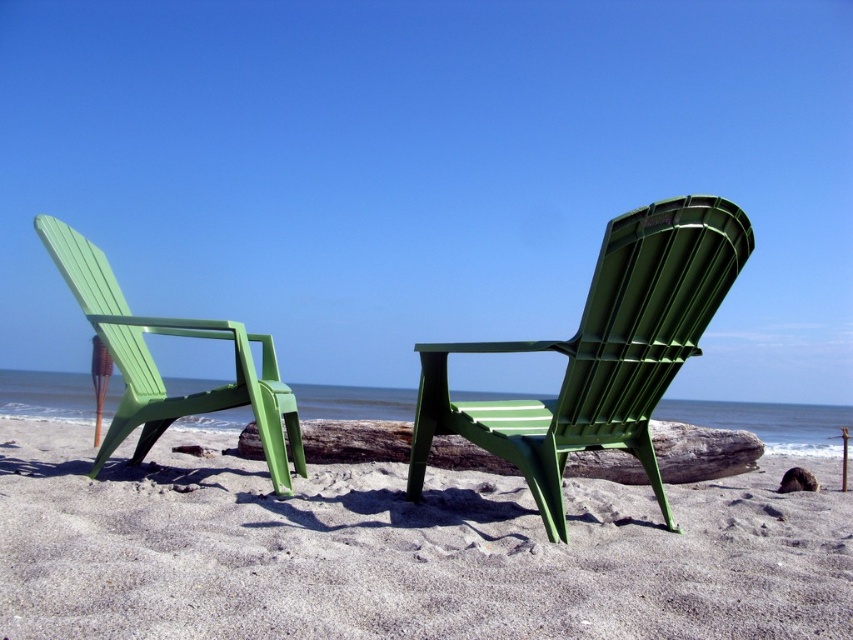
Can you confirm if matte green plastic beach chair at left is positioned below wooden log at center?

No, matte green plastic beach chair at left is not below wooden log at center.

Can you confirm if matte green plastic beach chair at left is taller than wooden log at center?

Correct, matte green plastic beach chair at left is much taller as wooden log at center.

The width and height of the screenshot is (853, 640). What are the coordinates of `matte green plastic beach chair at left` in the screenshot? It's located at (155, 369).

Can you confirm if sandy beige sand at center is shorter than green plastic beach chair at center?

Yes.

The height and width of the screenshot is (640, 853). In order to click on sandy beige sand at center in this screenshot , I will do [x=399, y=552].

Based on the photo, is green plastic beach chair at center above matte green plastic beach chair at left?

Actually, green plastic beach chair at center is below matte green plastic beach chair at left.

Can you confirm if green plastic beach chair at center is thinner than matte green plastic beach chair at left?

Yes, green plastic beach chair at center is thinner than matte green plastic beach chair at left.

Between point (663, 298) and point (134, 412), which one is positioned behind?

The point (134, 412) is behind.

You are a GUI agent. You are given a task and a screenshot of the screen. Output one action in this format:
    pyautogui.click(x=<x>, y=<y>)
    Task: Click on the green plastic beach chair at center
    The image size is (853, 640).
    Given the screenshot: What is the action you would take?
    pyautogui.click(x=601, y=353)